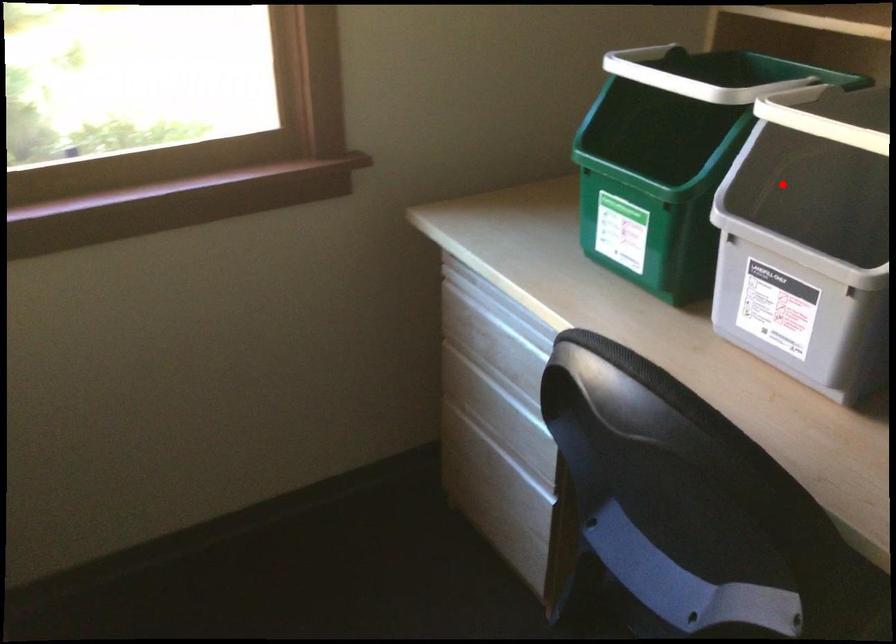
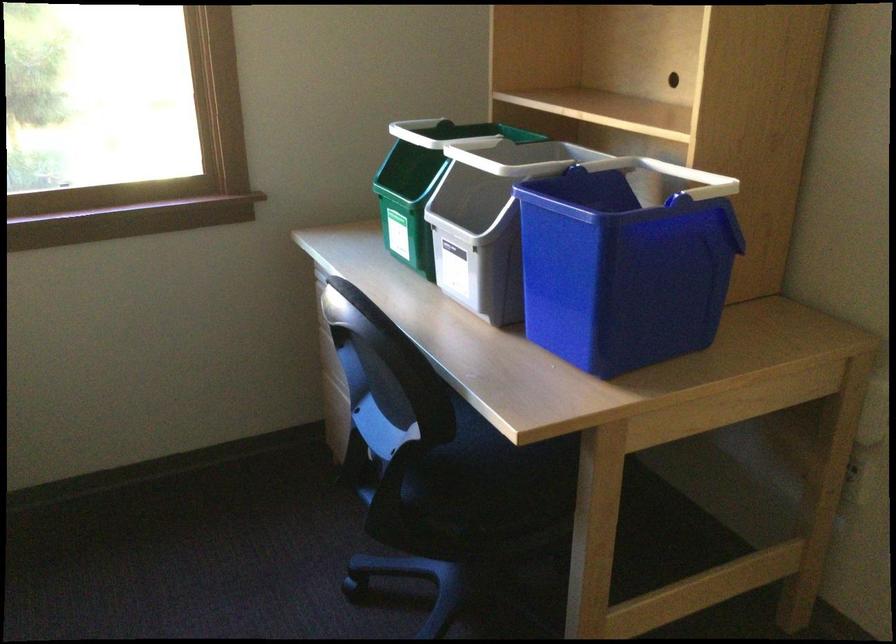
Question: I am providing you with two images of the same scene from different viewpoints. In image1, a red point is highlighted. Considering the same 3D point in image2, which of the following is correct?

Choices:
 (A) It is closer
 (B) It is farther

Answer: (B)